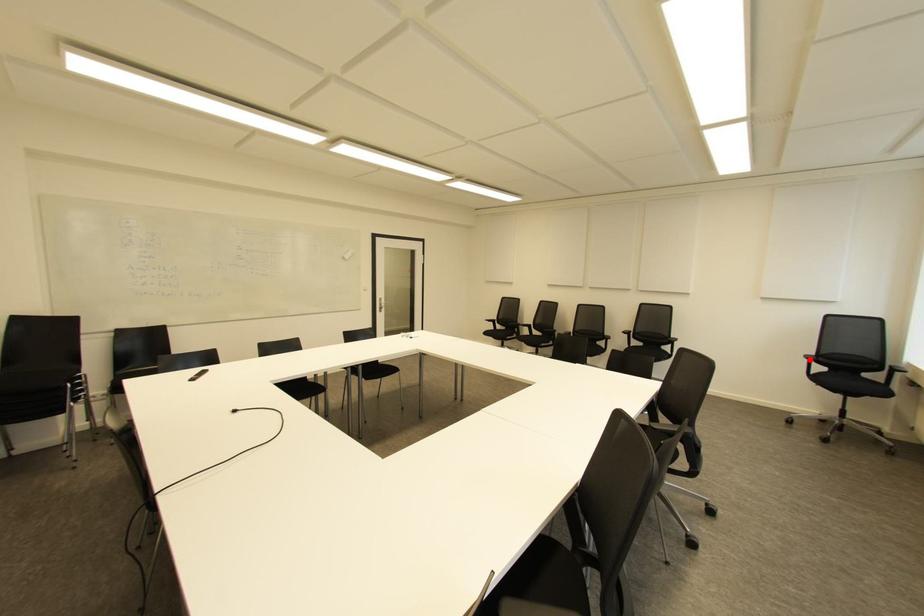
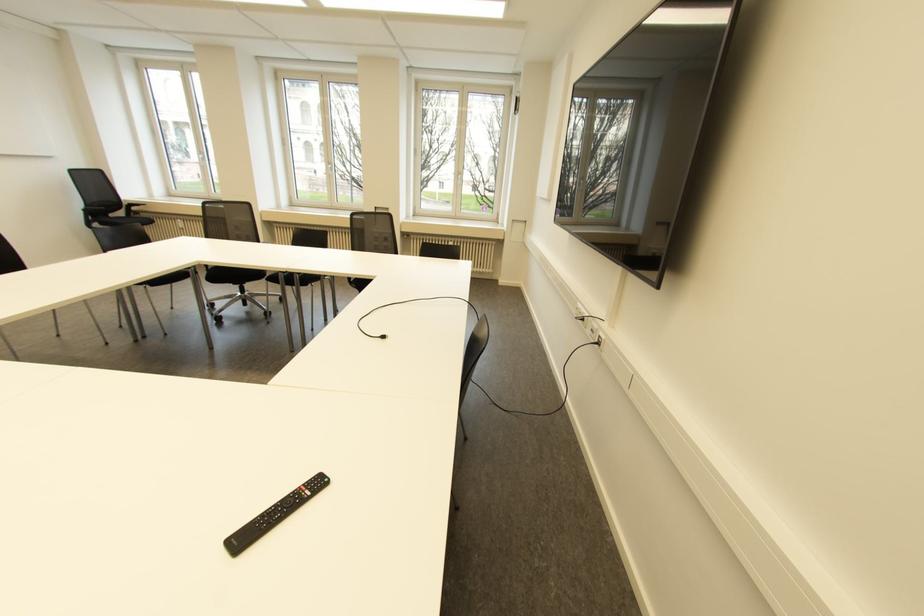
Question: I am providing you with two images of the same scene from different viewpoints. Image1 has a red point marked. In image2, the corresponding 3D location appears at what relative position? Reply with the corresponding letter.

Choices:
 (A) Closer
 (B) Farther

Answer: (B)